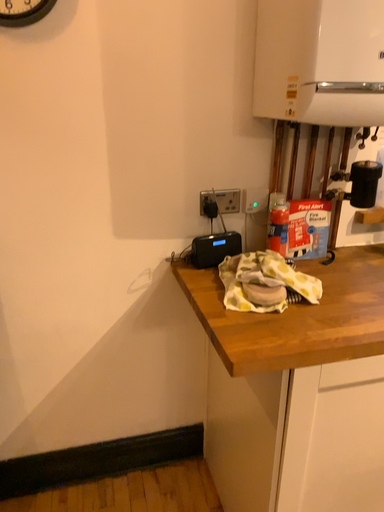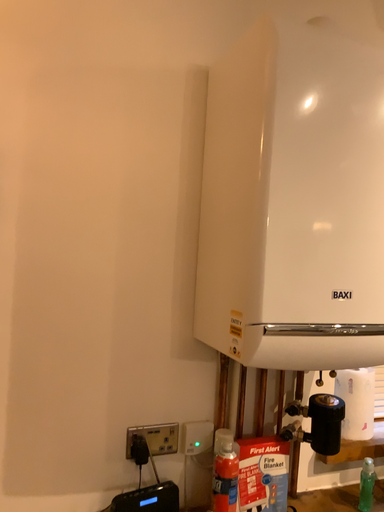
Question: Which way did the camera rotate in the video?

Choices:
 (A) rotated right
 (B) rotated left

Answer: (A)